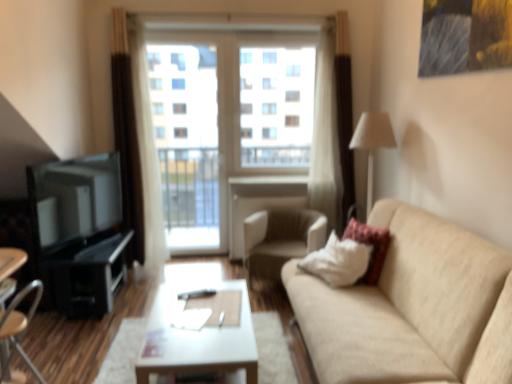
At what (x,y) coordinates should I click in order to perform the action: click on blank space situated above white glossy coffee table at center (from a real-world perspective). Please return your answer as a coordinate pair (x, y). This screenshot has height=384, width=512. Looking at the image, I should click on (200, 318).